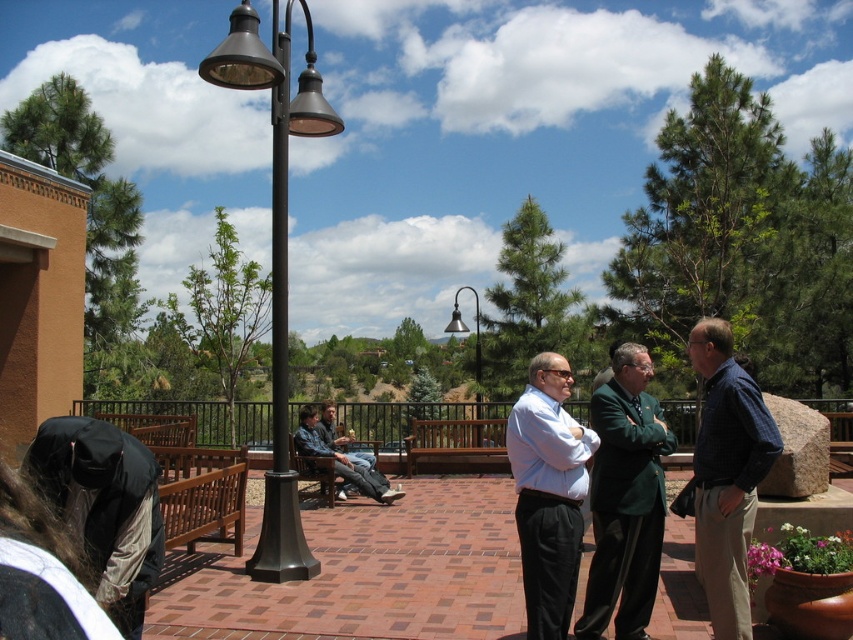
Does point (733, 387) lie in front of point (543, 636)?

No, it is not.

Which is more to the right, blue plaid shirt at right or light blue shirt at center?

From the viewer's perspective, blue plaid shirt at right appears more on the right side.

Locate an element on the screen. The image size is (853, 640). blue plaid shirt at right is located at coordinates 724,476.

Does green fabric jacket at center lie in front of denim jacket at center?

Yes, green fabric jacket at center is in front of denim jacket at center.

Where is `green fabric jacket at center`? green fabric jacket at center is located at coordinates (625, 499).

You are a GUI agent. You are given a task and a screenshot of the screen. Output one action in this format:
    pyautogui.click(x=<x>, y=<y>)
    Task: Click on the green fabric jacket at center
    This screenshot has height=640, width=853.
    Given the screenshot: What is the action you would take?
    pyautogui.click(x=625, y=499)

Identify the location of green fabric jacket at center. Image resolution: width=853 pixels, height=640 pixels. (625, 499).

Which is in front, point (734, 570) or point (300, 440)?

Point (734, 570) is more forward.

Is blue plaid shirt at right in front of denim jacket at center?

Yes, blue plaid shirt at right is in front of denim jacket at center.

The height and width of the screenshot is (640, 853). What do you see at coordinates (724, 476) in the screenshot?
I see `blue plaid shirt at right` at bounding box center [724, 476].

Find the location of a particular element. blue plaid shirt at right is located at coordinates (724, 476).